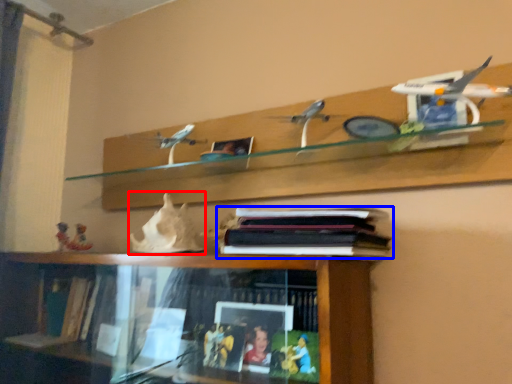
Question: Which point is closer to the camera, toy (highlighted by a red box) or book (highlighted by a blue box)?

Choices:
 (A) toy
 (B) book

Answer: (B)